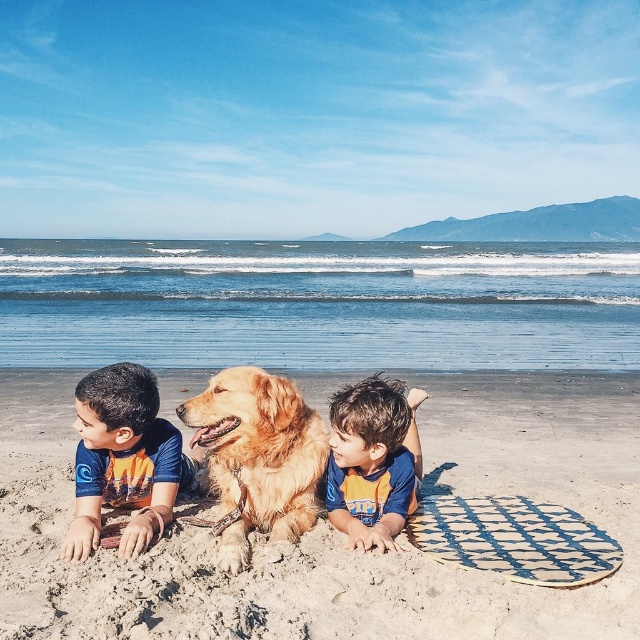
In the scene shown: You are a photographer trying to capture a photo of the golden fur dog at center and the blue and orange swimsuit at center. Based on their sizes, which one should you focus on first to ensure they both fit in the frame?

The golden fur dog at center is taller than the blue and orange swimsuit at center, so you should focus on the golden fur dog at center first to ensure both fit in the frame.

You are a photographer standing on the beach and want to take a photo that includes both the golden fur dog at center and the blue and orange swimsuit at center. Which object should you focus on first to ensure both are in sharp focus?

The golden fur dog at center is closer to the viewer than the blue and orange swimsuit at center. To ensure both are in sharp focus, you should focus on the golden fur dog at center first since it is closer, and the swimsuit will be within the depth of field if the focus is properly set.

What is the 2D coordinate of the golden sand at center?

The golden sand at center is located at the 2D coordinate point of (333,531).